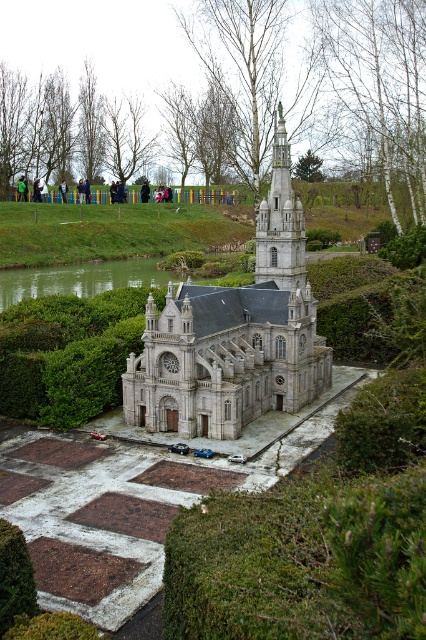
Is point (287, 227) positioned in front of point (152, 273)?

Yes, point (287, 227) is closer to viewer.

Find the location of a particular element. white stone tower at upper center is located at coordinates (281, 221).

Who is more distant from viewer, (293, 225) or (63, 280)?

The point (63, 280) is behind.

This screenshot has height=640, width=426. I want to click on white stone tower at upper center, so click(281, 221).

Is green grass at center shorter than stone church at center?

Yes.

Does green grass at center have a larger size compared to stone church at center?

Indeed, green grass at center has a larger size compared to stone church at center.

This screenshot has height=640, width=426. I want to click on green grass at center, so click(x=111, y=452).

Which is more to the right, stone church at center or white stone tower at upper center?

white stone tower at upper center is more to the right.

Between stone church at center and white stone tower at upper center, which one is positioned lower?

Positioned lower is stone church at center.

Identify the location of stone church at center. (235, 333).